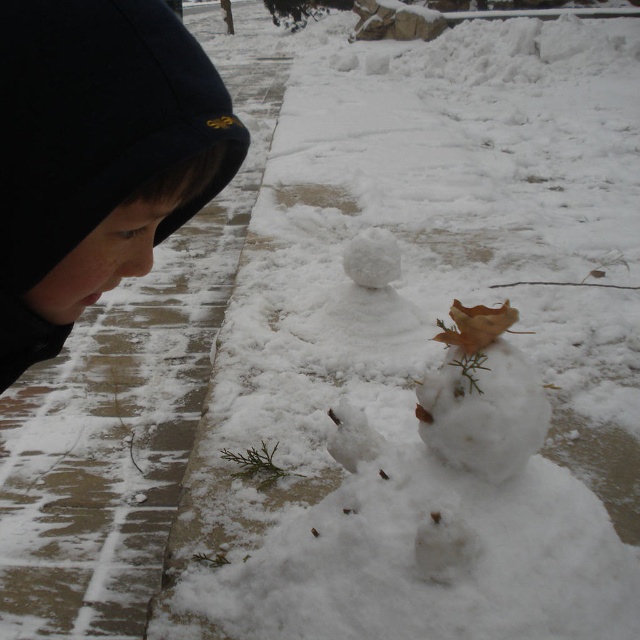
Is black fleece at upper left to the left of brown leafy snowman at center from the viewer's perspective?

Correct, you'll find black fleece at upper left to the left of brown leafy snowman at center.

Identify the location of black fleece at upper left. (97, 156).